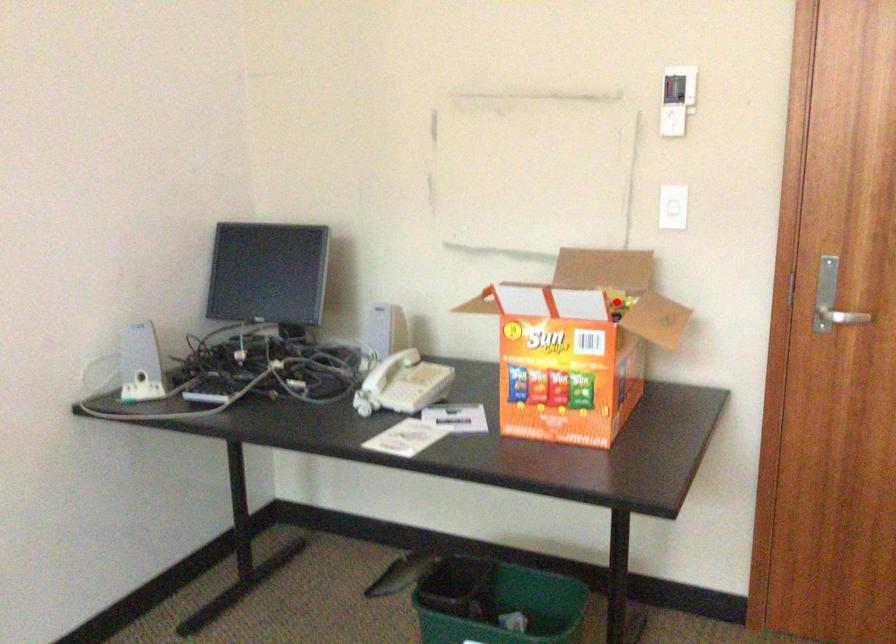
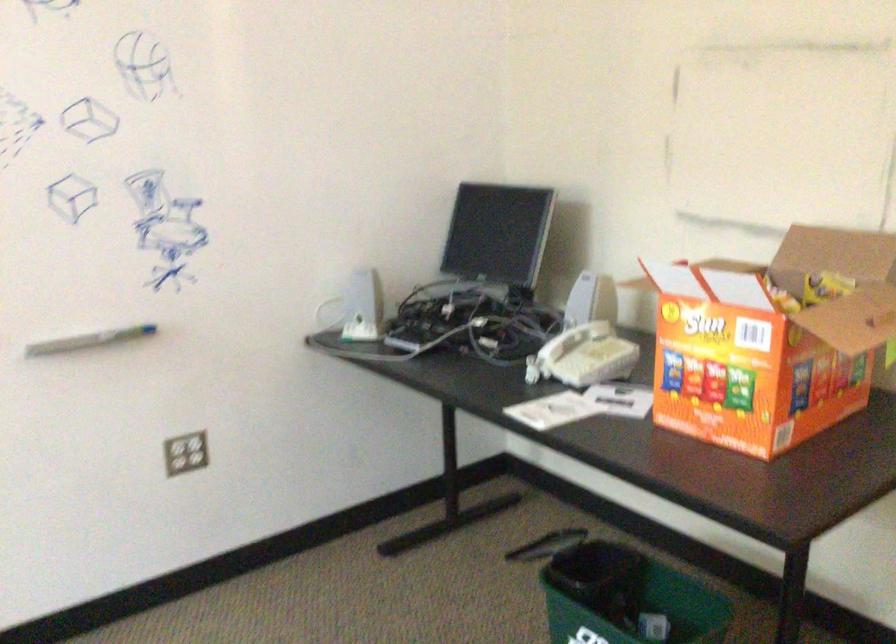
The point at the highlighted location is marked in the first image. Where is the corresponding point in the second image?

(824, 287)